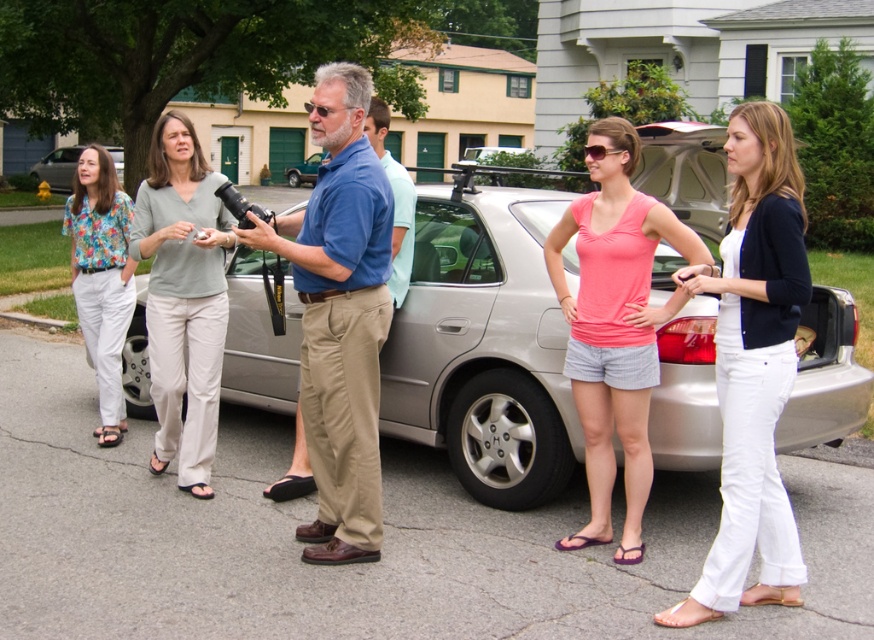
You are a photographer standing near the group and want to position yourself to the left of both the satin silver sedan at center and the matte silver sedan at left. Is this possible given their positions?

The satin silver sedan at center is to the right of the matte silver sedan at left, so positioning yourself to the left of both would require standing to the left of the matte silver sedan at left, which is feasible.

You are standing at the origin point of the coordinate system in the image. The image has a coordinate system where the bottom left corner is the origin. You want to take a photo of the satin silver sedan at center. In which direction should you move to get a better angle?

The satin silver sedan at center is located at coordinates approximately 0.545 on the x and 0.554 on the y axis. Since the origin is at the bottom left corner, moving towards the right or upward would bring you closer to the sedan. However, to frame it better, moving slightly to the right and upward from your current position would provide a more centered composition.

You are standing at the point with coordinates (483, 348) in the image. What object are you directly facing?

The point at coordinates (483, 348) corresponds to the satin silver sedan at center, so you are directly facing the satin silver sedan at center.